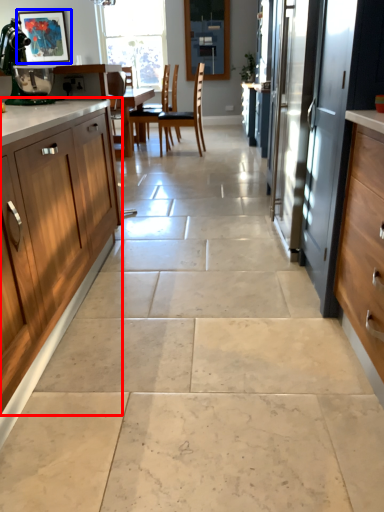
Question: Which point is further to the camera, cabinetry (highlighted by a red box) or picture frame (highlighted by a blue box)?

Choices:
 (A) cabinetry
 (B) picture frame

Answer: (B)